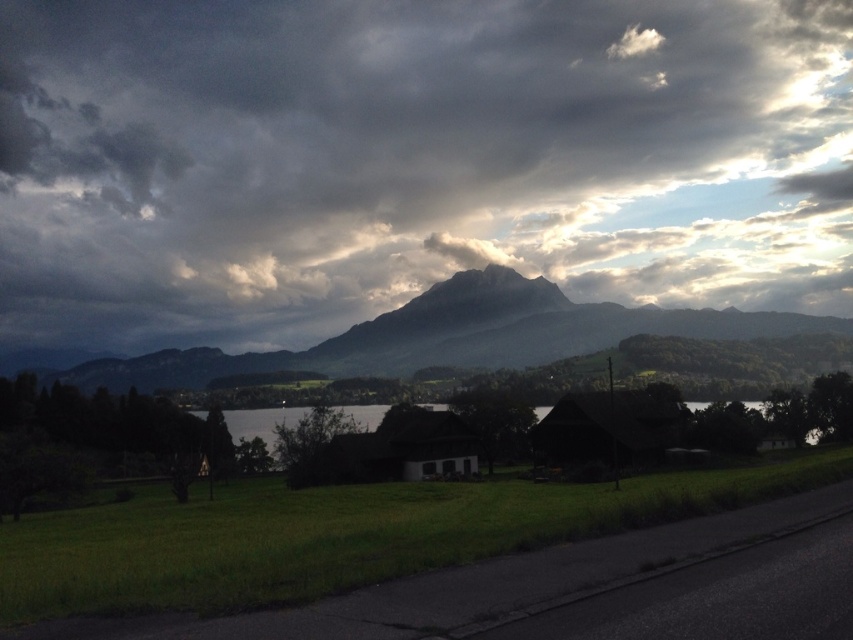
You are a hiker who wants to take a photo of the rugged granite mountain at center and the dark gray cloud at upper center. Which object should you focus on first if you want to capture both in a single frame without moving your camera? Explain your reasoning based on their positions.

You should focus on the rugged granite mountain at center first because the dark gray cloud at upper center is positioned to the left of it. By centering the mountain in your frame, you can adjust your camera to include the cloud to its left without needing to reposition.

You are a hiker standing on the road in the foreground of the image. You see the dark gray cloud at upper center and the rugged granite mountain at center. Which one appears taller from your perspective?

The dark gray cloud at upper center appears taller than the rugged granite mountain at center because it has a greater height compared to it according to the description.